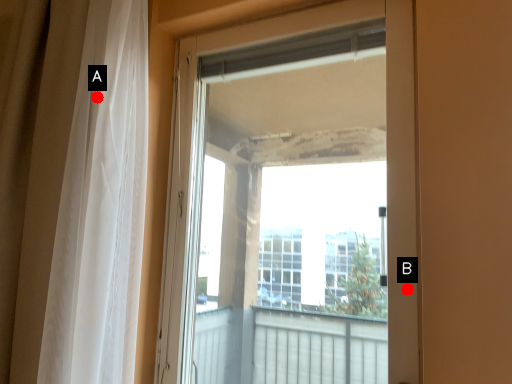
Question: Two points are circled on the image, labeled by A and B beside each circle. Which point is closer to the camera?

Choices:
 (A) A is closer
 (B) B is closer

Answer: (B)